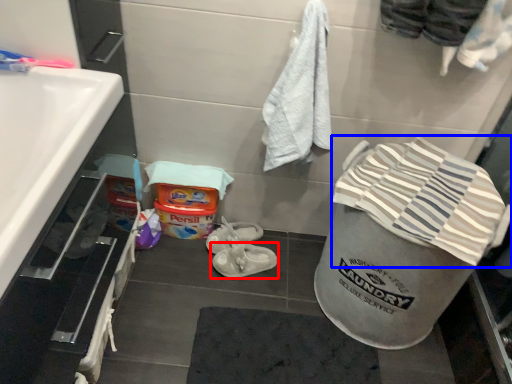
Question: Which point is further to the camera, footwear (highlighted by a red box) or beach towel (highlighted by a blue box)?

Choices:
 (A) footwear
 (B) beach towel

Answer: (A)